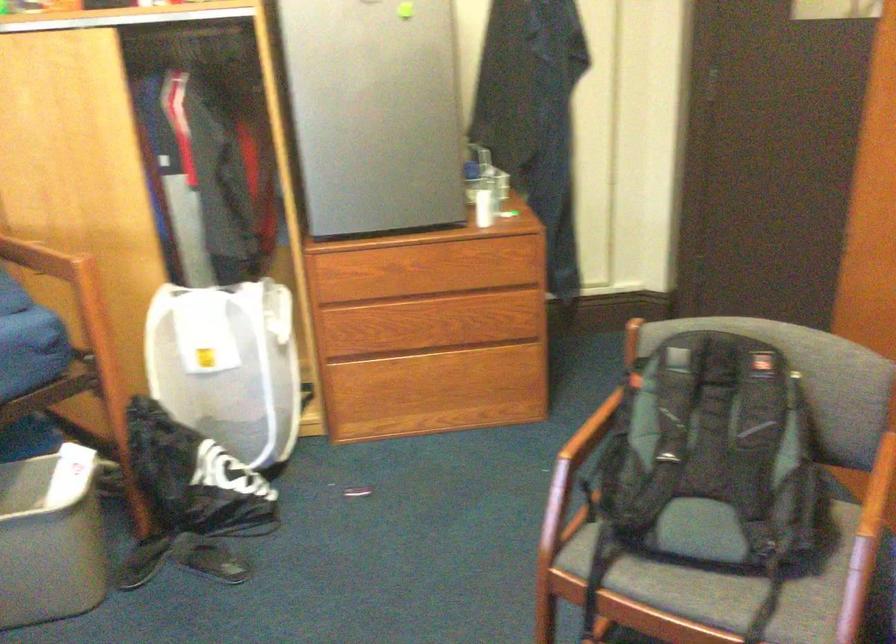
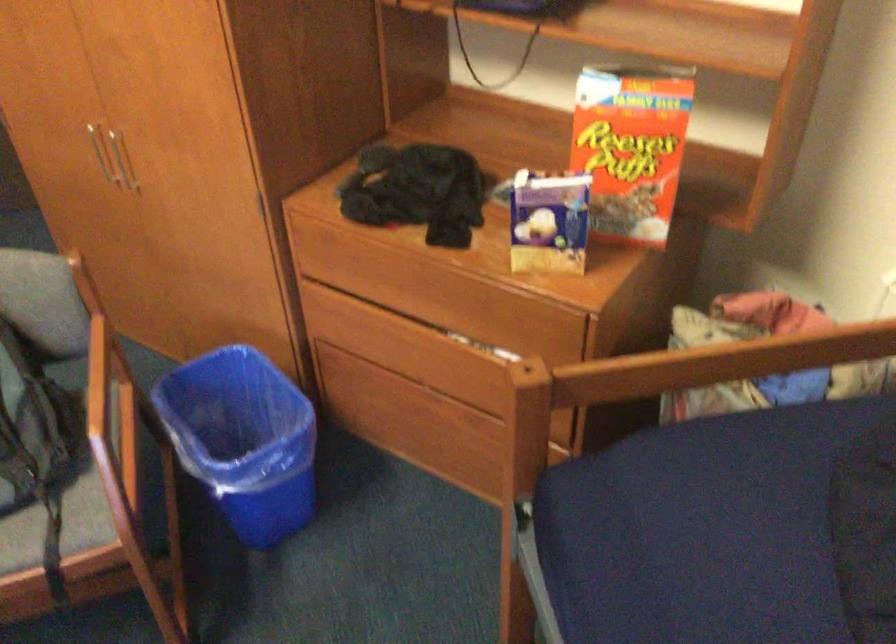
How did the camera likely rotate?

The camera's rotation is toward right-down.